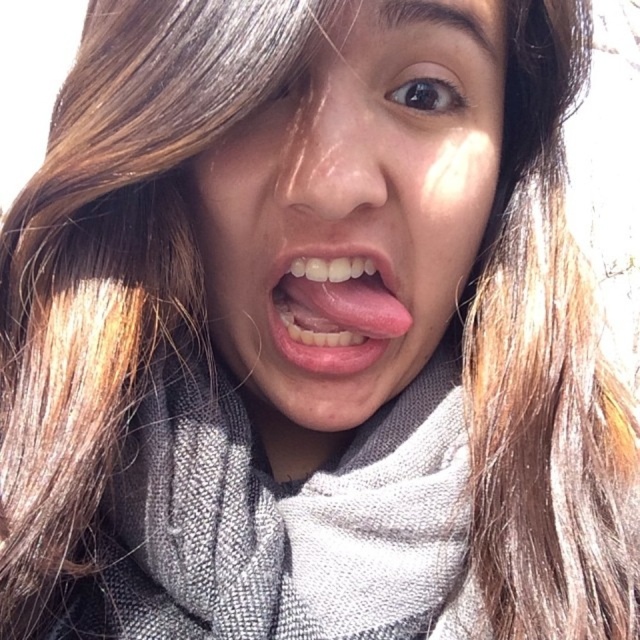
Which is behind, point (220, 220) or point (128, 468)?

The point (128, 468) is more distant.

Who is taller, matte gray scarf at center or gray knitted scarf at center?

With more height is matte gray scarf at center.

The width and height of the screenshot is (640, 640). I want to click on matte gray scarf at center, so (353, 209).

Is matte gray scarf at center smaller than pink matte tongue at center?

No, matte gray scarf at center is not smaller than pink matte tongue at center.

Between matte gray scarf at center and pink matte tongue at center, which one appears on the left side from the viewer's perspective?

pink matte tongue at center

Is point (298, 296) farther from camera compared to point (284, 305)?

No, (298, 296) is in front of (284, 305).

Locate an element on the screen. This screenshot has height=640, width=640. matte gray scarf at center is located at coordinates (353, 209).

Is gray knitted scarf at center below pink matte tongue at center?

Correct, gray knitted scarf at center is located below pink matte tongue at center.

Between point (147, 512) and point (296, 355), which one is positioned in front?

Positioned in front is point (296, 355).

At what (x,y) coordinates should I click in order to perform the action: click on gray knitted scarf at center. Please return your answer as a coordinate pair (x, y). The height and width of the screenshot is (640, 640). Looking at the image, I should click on (282, 524).